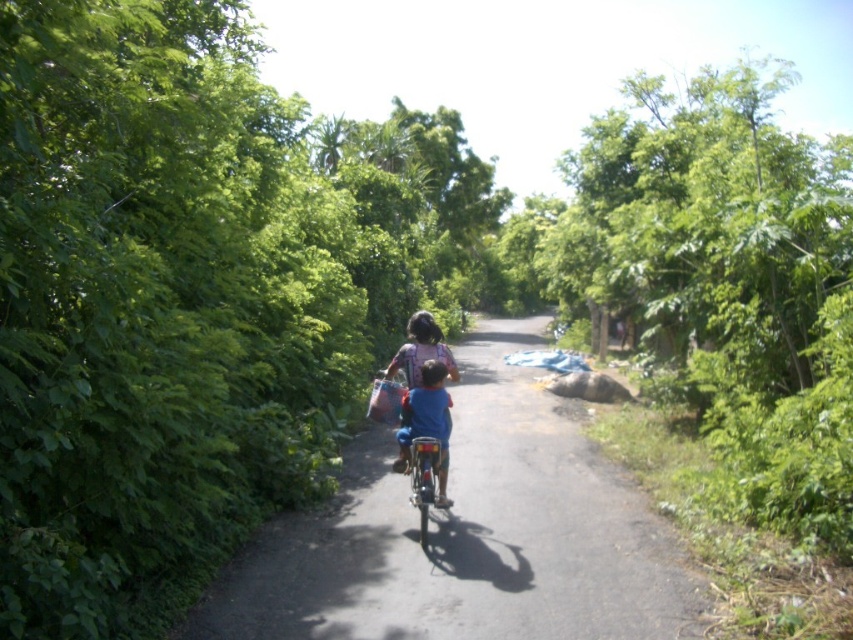
Question: Is smooth asphalt road at center wider than blue matte shirt at center?

Choices:
 (A) no
 (B) yes

Answer: (B)

Question: Which point is closer to the camera?

Choices:
 (A) (425, 502)
 (B) (518, 456)
 (C) (439, 362)

Answer: (A)

Question: Which point is farther to the camera?

Choices:
 (A) metallic blue bicycle at center
 (B) blue matte shirt at center
 (C) smooth asphalt road at center

Answer: (B)

Question: Is blue matte shirt at center below metallic blue bicycle at center?

Choices:
 (A) yes
 (B) no

Answer: (B)

Question: Considering the relative positions of smooth asphalt road at center and metallic blue bicycle at center in the image provided, where is smooth asphalt road at center located with respect to metallic blue bicycle at center?

Choices:
 (A) left
 (B) right

Answer: (B)

Question: Estimate the real-world distances between objects in this image. Which object is farther from the smooth asphalt road at center?

Choices:
 (A) blue matte shirt at center
 (B) metallic blue bicycle at center

Answer: (A)